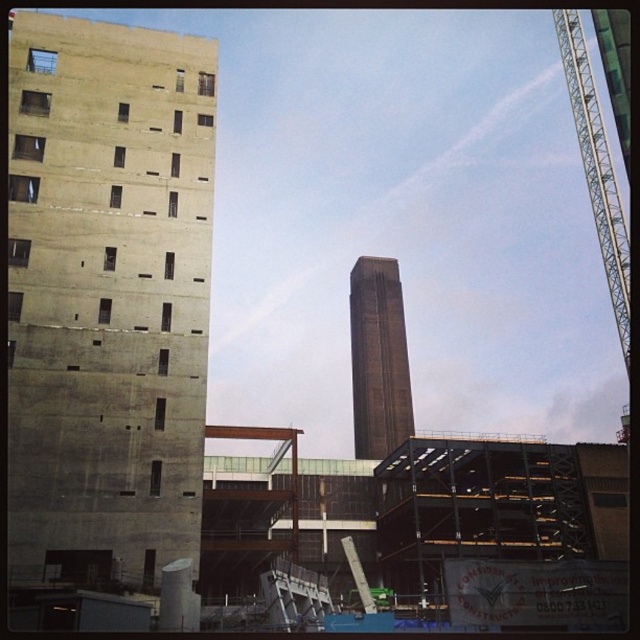
Consider the image. You are a surveyor standing at the construction site. You need to determine which of the two points, point (x=193, y=168) or point (x=365, y=273), is closer to your current position. Based on the image provided, which point is nearer to you?

Point (x=193, y=168) is closer to the camera than point (x=365, y=273), so the surveyor is closer to point (x=193, y=168).

You are a city planner reviewing this construction site. The brown brick tower at center and the green metallic crane at upper right are both visible in the image. Which of these two structures takes up more visual space in the image?

The green metallic crane at upper right occupies more visual space than the brown brick tower at center because the brown brick tower at center occupies less space than green metallic crane at upper right.

You are standing at the center of the construction site and see a point marked at coordinates (108, 291). Which object in the scene does this point belong to?

The point at coordinates (108, 291) is on the concrete tower at left.